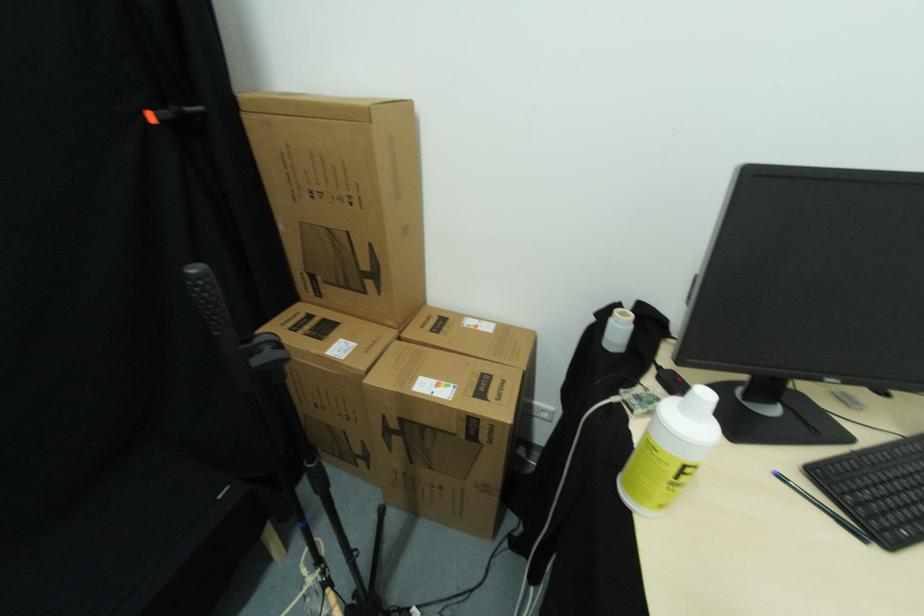
Locate an element on the screen. The width and height of the screenshot is (924, 616). white spray bottle is located at coordinates (670, 451).